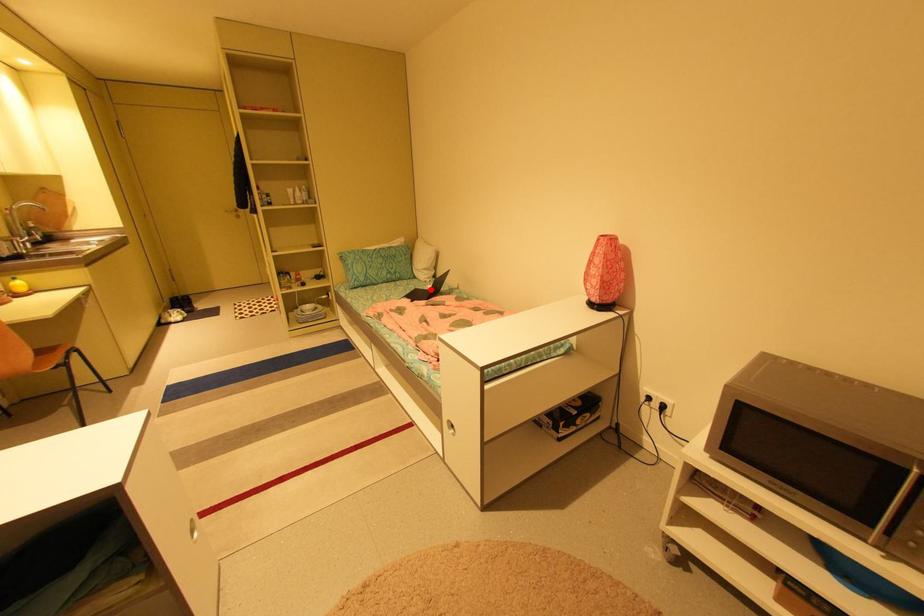
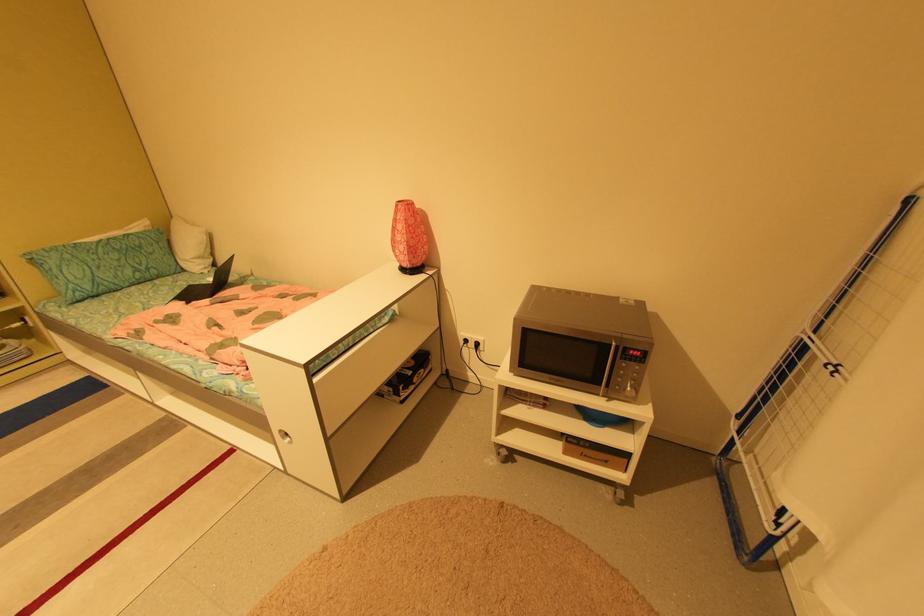
Question: I am providing you with two images of the same scene from different viewpoints. A red point is shown in image1. For the corresponding object point in image2, is it positioned nearer or farther from the camera?

Choices:
 (A) Nearer
 (B) Farther

Answer: (A)